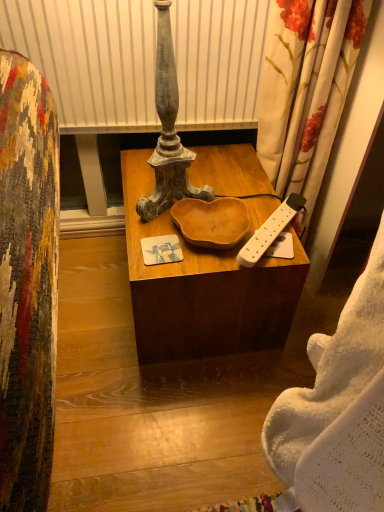
At what (x,y) coordinates should I click in order to perform the action: click on vacant position to the left of wooden bowl at center. Please return your answer as a coordinate pair (x, y). Image resolution: width=384 pixels, height=512 pixels. Looking at the image, I should click on [x=95, y=290].